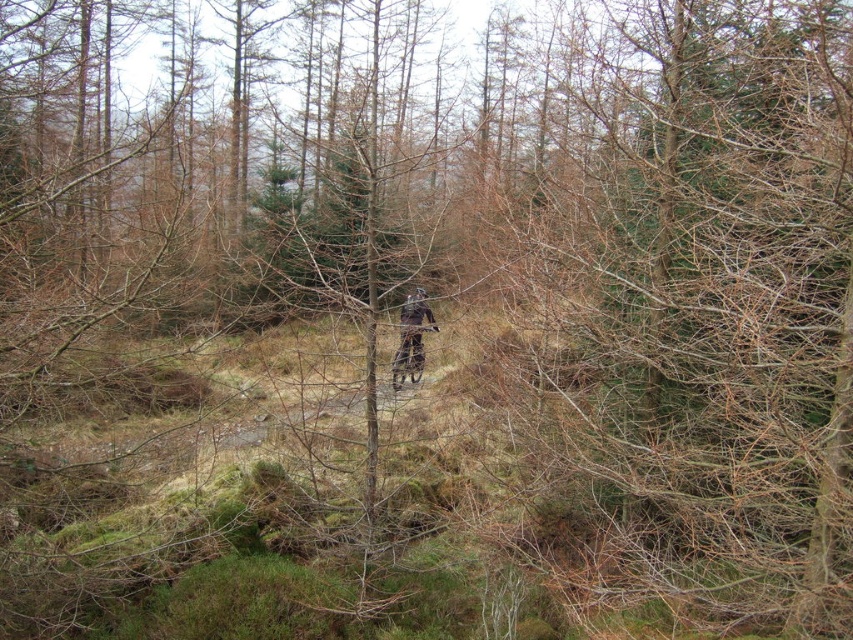
Is point (421, 369) closer to camera compared to point (397, 368)?

No, (421, 369) is behind (397, 368).

What do you see at coordinates (412, 330) in the screenshot?
I see `dark brown leather jacket at center` at bounding box center [412, 330].

Measure the distance between point (x=432, y=326) and camera.

The distance of point (x=432, y=326) from camera is 5.97 meters.

At what (x,y) coordinates should I click in order to perform the action: click on dark brown leather jacket at center. Please return your answer as a coordinate pair (x, y). This screenshot has height=640, width=853. Looking at the image, I should click on (412, 330).